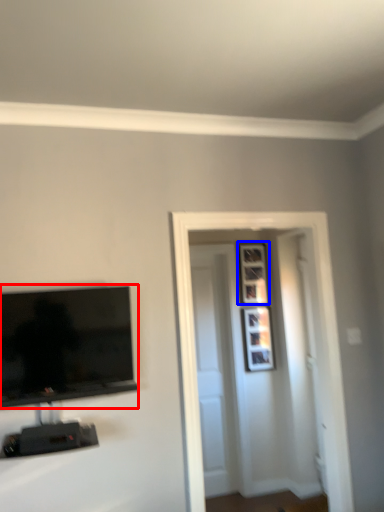
Question: Which point is closer to the camera, television (highlighted by a red box) or picture frame (highlighted by a blue box)?

Choices:
 (A) television
 (B) picture frame

Answer: (A)